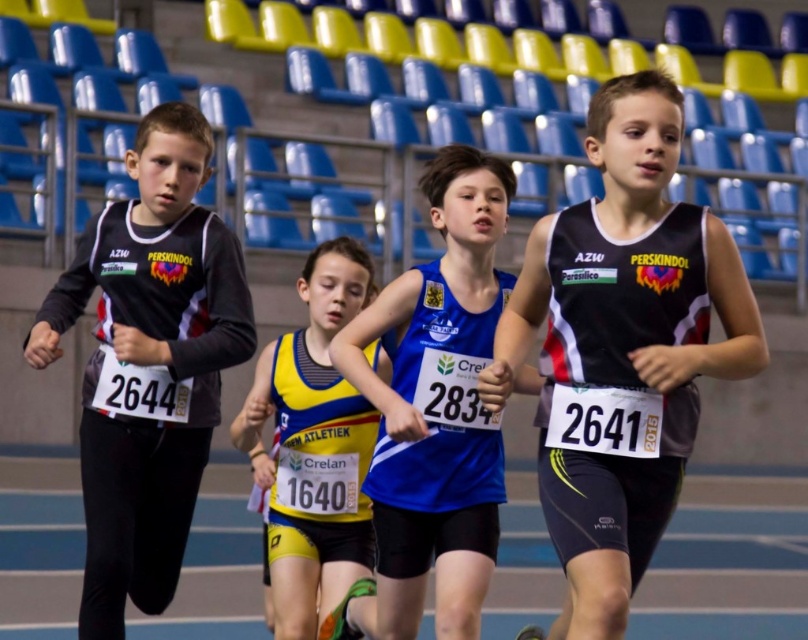
You are a photographer positioned at the front of the track. You need to capture a closeup shot of both the black mesh tank top at right and the yellow and black jersey at center. Based on their positions, which athlete should you focus on first to ensure you capture them clearly in your frame?

You should focus on the yellow and black jersey at center first because it is closer to you than the black mesh tank top at right, so it will appear larger and clearer in your photo.

Based on the scene description, which athlete is positioned higher in the image, the one wearing the black mesh tank top at right or the blue fabric running suit at center?

The black mesh tank top at right is positioned higher in the image than the blue fabric running suit at center.